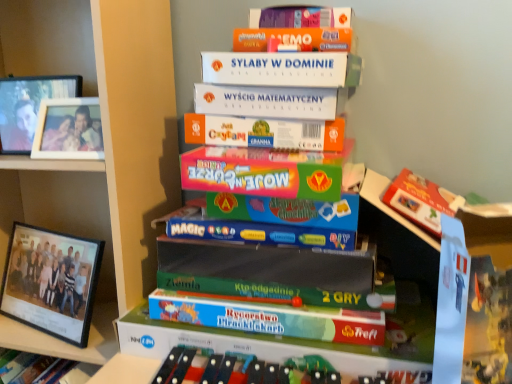
Measure the distance between point (29, 311) and camera.

37.83 inches.

The image size is (512, 384). I want to click on wooden photo frame at left, positioned as the second picture frame in bottom-to-top order, so click(69, 129).

Locate an element on the screen. This screenshot has height=384, width=512. matte plastic game at center, the 1th book positioned from the bottom is located at coordinates (242, 369).

This screenshot has width=512, height=384. I want to click on black plastic picture frame at left, which ranks as the 3th picture frame in top-to-bottom order, so click(51, 281).

Can you confirm if matte plastic game at center, which is the 2th book from top to bottom, is wider than green matte board game at center, arranged as the 1th book when viewed from the top?

No.

Which is behind, point (259, 373) or point (250, 325)?

The point (250, 325) is behind.

Could you tell me if matte plastic game at center, which is the 2th book from top to bottom, is turned towards green matte board game at center, arranged as the 1th book when viewed from the top?

No.

Is black plastic picture frame at left, which ranks as the 3th picture frame in top-to-bottom order, taller or shorter than wooden photo frame at left, the 3th picture frame positioned from the bottom?

Clearly, black plastic picture frame at left, which ranks as the 3th picture frame in top-to-bottom order, is taller compared to wooden photo frame at left, the 3th picture frame positioned from the bottom.

Does black plastic picture frame at left, the 1th picture frame ordered from the bottom, appear on the right side of wooden photo frame at left, the 3th picture frame positioned from the bottom?

No, black plastic picture frame at left, the 1th picture frame ordered from the bottom, is not to the right of wooden photo frame at left, the 3th picture frame positioned from the bottom.

Does point (81, 250) come closer to viewer compared to point (21, 150)?

That is False.

Considering the sizes of objects black plastic picture frame at left, which ranks as the 3th picture frame in top-to-bottom order, and wooden photo frame at left, the 3th picture frame positioned from the bottom, in the image provided, who is smaller, black plastic picture frame at left, which ranks as the 3th picture frame in top-to-bottom order, or wooden photo frame at left, the 3th picture frame positioned from the bottom,?

Smaller between the two is wooden photo frame at left, the 3th picture frame positioned from the bottom.

Based on the photo, between green matte board game at center, acting as the 2th book starting from the bottom, and matte plastic game at center, which is the 2th book from top to bottom, which one appears on the left side from the viewer's perspective?

From the viewer's perspective, matte plastic game at center, which is the 2th book from top to bottom, appears more on the left side.

Is green matte board game at center, arranged as the 1th book when viewed from the top, turned away from matte plastic game at center, the 1th book positioned from the bottom?

That's not correct — green matte board game at center, arranged as the 1th book when viewed from the top, is not looking away from matte plastic game at center, the 1th book positioned from the bottom.

Which object is more forward, green matte board game at center, acting as the 2th book starting from the bottom, or matte plastic game at center, the 1th book positioned from the bottom?

matte plastic game at center, the 1th book positioned from the bottom, is more forward.

From the image's perspective, does black plastic picture frame at left, the 1th picture frame ordered from the bottom, appear higher than green matte board game at center, acting as the 2th book starting from the bottom?

Actually, black plastic picture frame at left, the 1th picture frame ordered from the bottom, appears below green matte board game at center, acting as the 2th book starting from the bottom, in the image.

Is point (24, 316) positioned after point (263, 318)?

Yes, it is.

From the picture: In terms of width, does black plastic picture frame at left, which ranks as the 3th picture frame in top-to-bottom order, look wider or thinner when compared to green matte board game at center, acting as the 2th book starting from the bottom?

Clearly, black plastic picture frame at left, which ranks as the 3th picture frame in top-to-bottom order, has less width compared to green matte board game at center, acting as the 2th book starting from the bottom.

Does black plastic picture frame at left, the 1th picture frame ordered from the bottom, appear on the left side of green matte board game at center, arranged as the 1th book when viewed from the top?

Indeed, black plastic picture frame at left, the 1th picture frame ordered from the bottom, is positioned on the left side of green matte board game at center, arranged as the 1th book when viewed from the top.

From the picture: Who is smaller, matte plastic game at center, which is the 2th book from top to bottom, or white cardboard boxes at center?

matte plastic game at center, which is the 2th book from top to bottom, is smaller.

Considering their positions, is matte plastic game at center, which is the 2th book from top to bottom, located in front of or behind white cardboard boxes at center?

matte plastic game at center, which is the 2th book from top to bottom, is behind white cardboard boxes at center.

What's the angular difference between matte plastic game at center, the 1th book positioned from the bottom, and white cardboard boxes at center's facing directions?

The angle between the facing direction of matte plastic game at center, the 1th book positioned from the bottom, and the facing direction of white cardboard boxes at center is 16.2 degrees.

Could you tell me if matte plastic game at center, which is the 2th book from top to bottom, is turned towards white cardboard boxes at center?

No, matte plastic game at center, which is the 2th book from top to bottom, is not aimed at white cardboard boxes at center.

Considering the relative sizes of wooden photo frame at left, positioned as the second picture frame in bottom-to-top order, and wooden photo frame at left, the 3th picture frame positioned from the bottom, in the image provided, is wooden photo frame at left, positioned as the second picture frame in bottom-to-top order, thinner than wooden photo frame at left, the 3th picture frame positioned from the bottom,?

Incorrect, the width of wooden photo frame at left, positioned as the second picture frame in bottom-to-top order, is not less than that of wooden photo frame at left, the 3th picture frame positioned from the bottom.

How many degrees apart are the facing directions of wooden photo frame at left, which appears as the second picture frame when viewed from the top, and wooden photo frame at left, the 3th picture frame positioned from the bottom?

7.17 degrees.

From a real-world perspective, between wooden photo frame at left, which appears as the second picture frame when viewed from the top, and wooden photo frame at left, the 3th picture frame positioned from the bottom, who is vertically lower?

In real-world perspective, wooden photo frame at left, which appears as the second picture frame when viewed from the top, is lower.

Is wooden photo frame at left, which appears as the second picture frame when viewed from the top, spatially inside wooden photo frame at left, the 1th picture frame viewed from the top, or outside of it?

The correct answer is: outside.

Looking at this image, is white cardboard boxes at center positioned with its back to matte plastic game at center, which is the 2th book from top to bottom?

No.

Considering the points (116, 8) and (324, 370), which point is in front, point (116, 8) or point (324, 370)?

Positioned in front is point (324, 370).

Is white cardboard boxes at center at the left side of matte plastic game at center, which is the 2th book from top to bottom?

Indeed, white cardboard boxes at center is positioned on the left side of matte plastic game at center, which is the 2th book from top to bottom.

Based on the photo, considering the relative sizes of white cardboard boxes at center and matte plastic game at center, the 1th book positioned from the bottom, in the image provided, is white cardboard boxes at center taller than matte plastic game at center, the 1th book positioned from the bottom,?

Correct, white cardboard boxes at center is much taller as matte plastic game at center, the 1th book positioned from the bottom.

Locate an element on the screen. The width and height of the screenshot is (512, 384). book lying on the right of matte plastic game at center, the 1th book positioned from the bottom is located at coordinates (255, 178).

Image resolution: width=512 pixels, height=384 pixels. There is a wooden photo frame at left, the 3th picture frame positioned from the bottom. Identify the location of the 2nd picture frame below it (from a real-world perspective). (51, 281).

Which object lies nearer to the anchor point matte plastic game at center, the 1th book positioned from the bottom, wooden photo frame at left, the 1th picture frame viewed from the top, or white cardboard boxes at center?

Among the two, white cardboard boxes at center is located nearer to matte plastic game at center, the 1th book positioned from the bottom.

Estimate the real-world distances between objects in this image. Which object is further from wooden photo frame at left, positioned as the second picture frame in bottom-to-top order, black plastic picture frame at left, which ranks as the 3th picture frame in top-to-bottom order, or matte plastic game at center, the 1th book positioned from the bottom?

matte plastic game at center, the 1th book positioned from the bottom, lies further to wooden photo frame at left, positioned as the second picture frame in bottom-to-top order, than the other object.

When comparing their distances from matte plastic game at center, the 1th book positioned from the bottom, does white cardboard boxes at center or wooden photo frame at left, positioned as the second picture frame in bottom-to-top order, seem closer?

white cardboard boxes at center.

From the image, which object appears to be farther from wooden photo frame at left, the 3th picture frame positioned from the bottom, white cardboard boxes at center or matte plastic game at center, the 1th book positioned from the bottom?

matte plastic game at center, the 1th book positioned from the bottom.

Which object lies nearer to the anchor point white cardboard boxes at center, green matte board game at center, acting as the 2th book starting from the bottom, or black plastic picture frame at left, the 1th picture frame ordered from the bottom?

Based on the image, black plastic picture frame at left, the 1th picture frame ordered from the bottom, appears to be nearer to white cardboard boxes at center.

When comparing their distances from green matte board game at center, arranged as the 1th book when viewed from the top, does wooden photo frame at left, positioned as the second picture frame in bottom-to-top order, or black plastic picture frame at left, which ranks as the 3th picture frame in top-to-bottom order, seem further?

black plastic picture frame at left, which ranks as the 3th picture frame in top-to-bottom order.

Based on their spatial positions, is white cardboard boxes at center or green matte board game at center, arranged as the 1th book when viewed from the top, closer to black plastic picture frame at left, the 1th picture frame ordered from the bottom?

white cardboard boxes at center lies closer to black plastic picture frame at left, the 1th picture frame ordered from the bottom, than the other object.

Which object lies nearer to the anchor point green matte board game at center, arranged as the 1th book when viewed from the top, wooden photo frame at left, the 3th picture frame positioned from the bottom, or matte plastic game at center, the 1th book positioned from the bottom?

Among the two, matte plastic game at center, the 1th book positioned from the bottom, is located nearer to green matte board game at center, arranged as the 1th book when viewed from the top.

At what (x,y) coordinates should I click in order to perform the action: click on picture frame between wooden photo frame at left, the 1th picture frame viewed from the top, and black plastic picture frame at left, the 1th picture frame ordered from the bottom, in the vertical direction. Please return your answer as a coordinate pair (x, y). Looking at the image, I should click on (69, 129).

Find the location of a particular element. This screenshot has width=512, height=384. picture frame between white cardboard boxes at center and black plastic picture frame at left, which ranks as the 3th picture frame in top-to-bottom order, along the z-axis is located at coordinates (69, 129).

This screenshot has width=512, height=384. Identify the location of book between white cardboard boxes at center and green matte board game at center, arranged as the 1th book when viewed from the top, in the horizontal direction. (242, 369).

Where is `book between black plastic picture frame at left, the 1th picture frame ordered from the bottom, and green matte board game at center, arranged as the 1th book when viewed from the top, in the horizontal direction`? The width and height of the screenshot is (512, 384). book between black plastic picture frame at left, the 1th picture frame ordered from the bottom, and green matte board game at center, arranged as the 1th book when viewed from the top, in the horizontal direction is located at coordinates (242, 369).